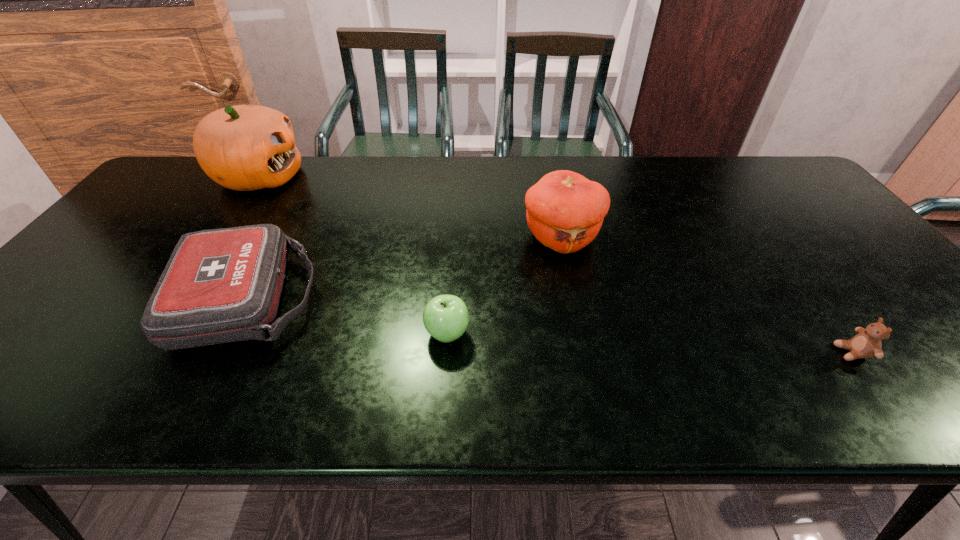
Where is `vacant area that satisfies the following two spatial constraints: 1. on the back side of the first-aid kit; 2. on the face of the tallest object`? vacant area that satisfies the following two spatial constraints: 1. on the back side of the first-aid kit; 2. on the face of the tallest object is located at coordinates (309, 177).

The image size is (960, 540). I want to click on free space that satisfies the following two spatial constraints: 1. on the face of the farther pumpkin; 2. on the left side of the right pumpkin, so click(218, 237).